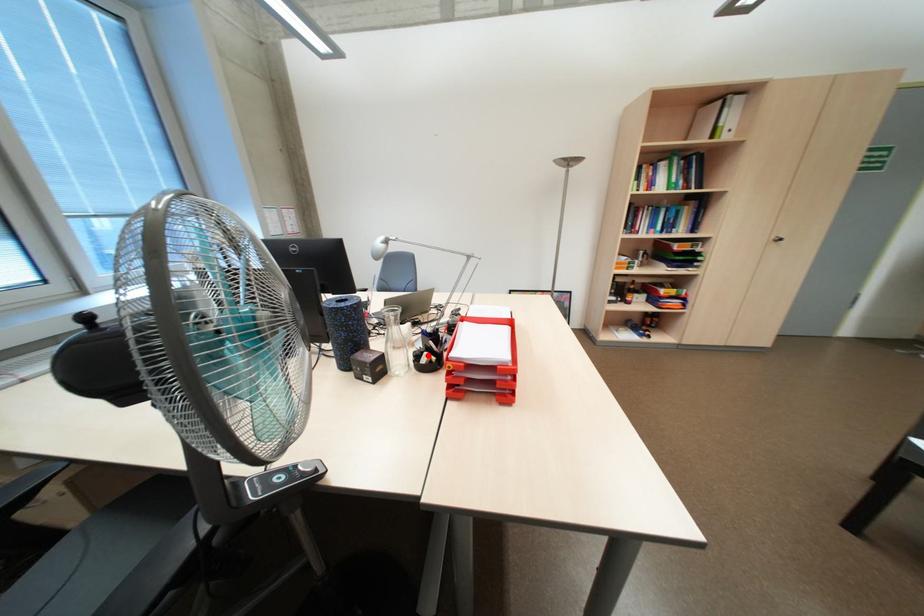
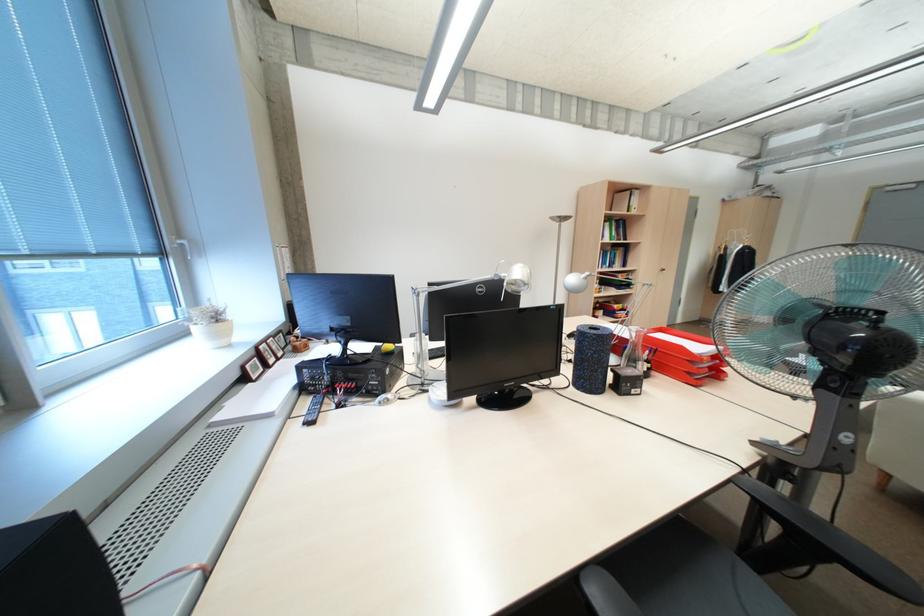
Question: I am providing you with two images of the same scene from different viewpoints. A red point is marked on the first image. Can you still see the location of the red point in image 2?

Choices:
 (A) Yes
 (B) No

Answer: (B)